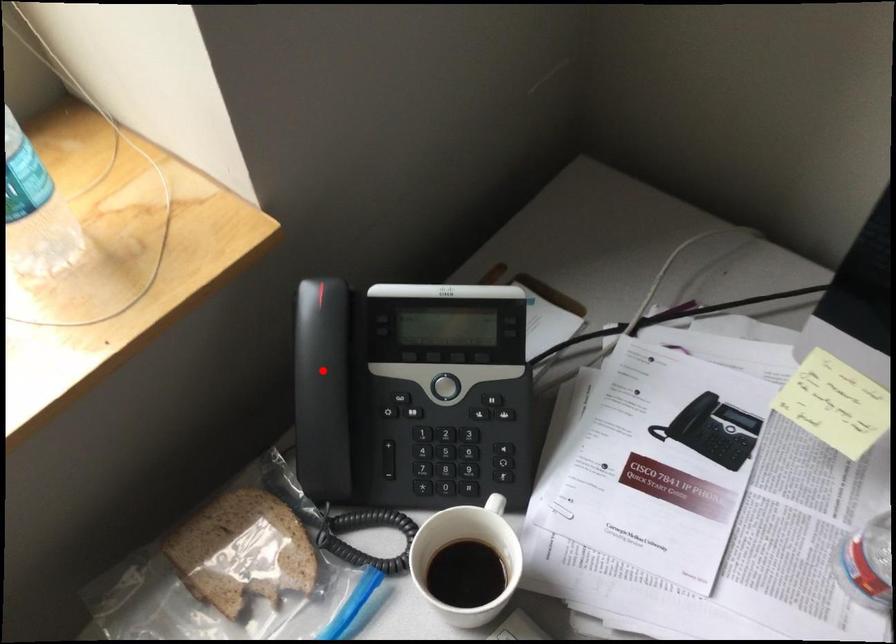
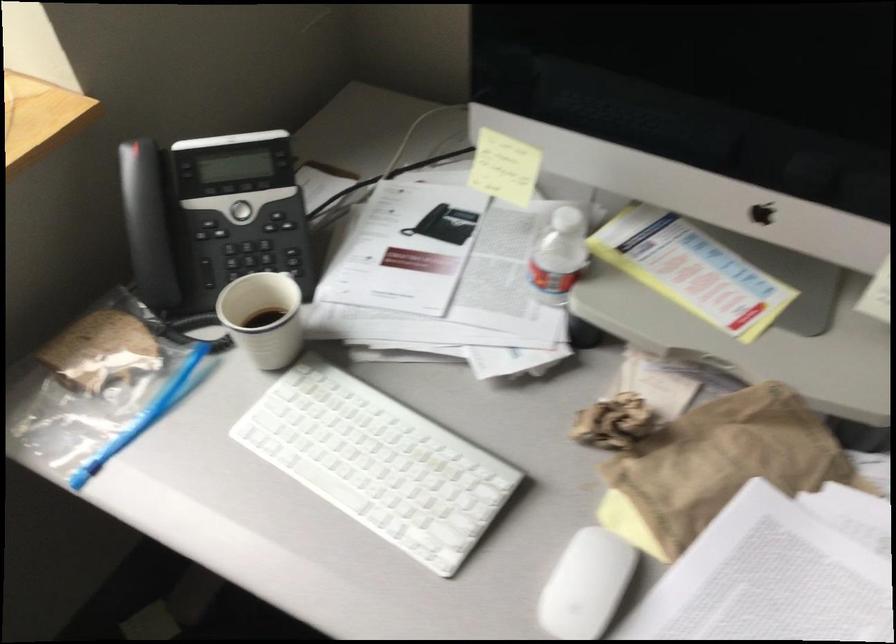
Question: I am providing you with two images of the same scene from different viewpoints. A red point is shown in image1. For the corresponding object point in image2, is it positioned nearer or farther from the camera?

Choices:
 (A) Nearer
 (B) Farther

Answer: (B)